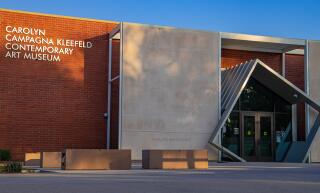
Find the location of a particular element. door is located at coordinates (265, 125), (249, 124).